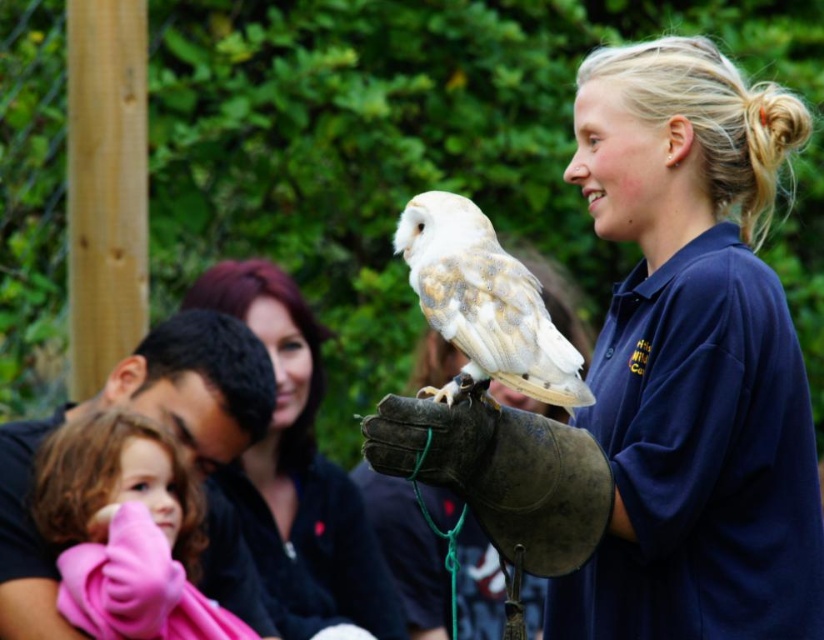
Question: Can you confirm if black cotton shirt at left is positioned to the left of white fluffy owl at center?

Choices:
 (A) no
 (B) yes

Answer: (B)

Question: From the image, what is the correct spatial relationship of blue smooth shirt at center in relation to smooth black shirt at center?

Choices:
 (A) left
 (B) right

Answer: (B)

Question: Among these objects, which one is nearest to the camera?

Choices:
 (A) blue smooth shirt at center
 (B) smooth black shirt at center

Answer: (A)

Question: Can you confirm if blue smooth shirt at center is thinner than black cotton shirt at left?

Choices:
 (A) no
 (B) yes

Answer: (A)

Question: Which point appears farthest from the camera in this image?

Choices:
 (A) (414, 244)
 (B) (311, 412)
 (C) (578, 138)

Answer: (B)

Question: Which point appears closest to the camera in this image?

Choices:
 (A) (233, 381)
 (B) (700, 195)

Answer: (B)